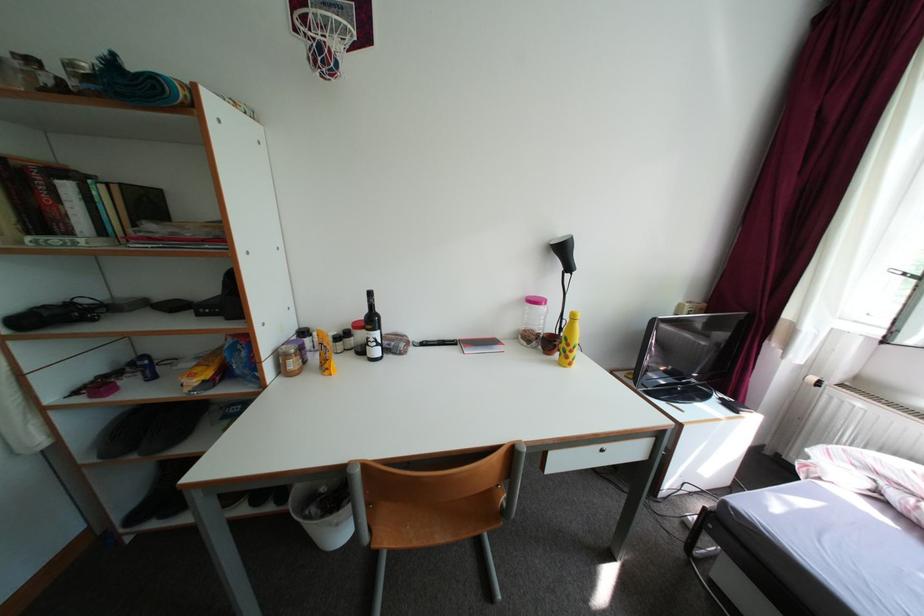
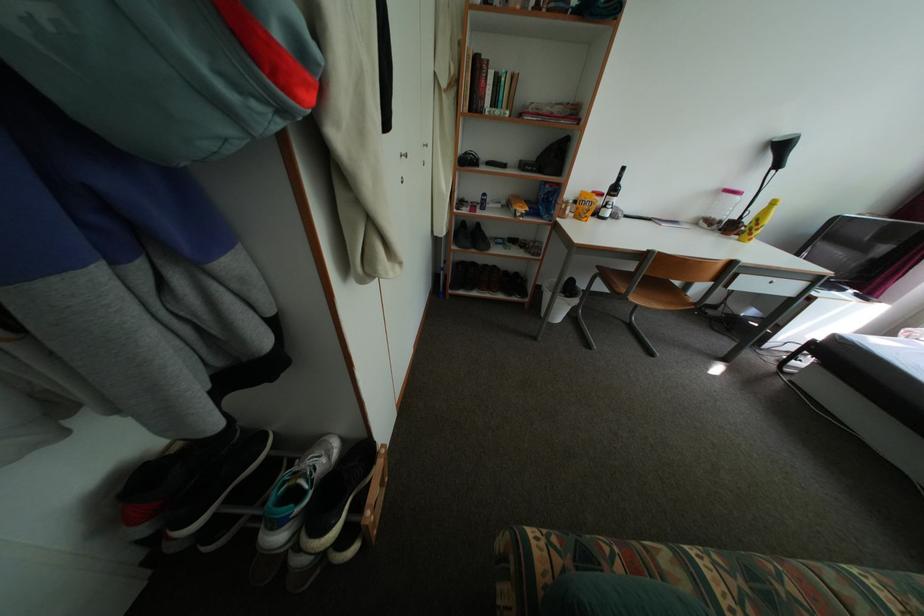
In a continuous first-person perspective shot, in which direction is the camera moving?

The cameraman walked toward left, backward.